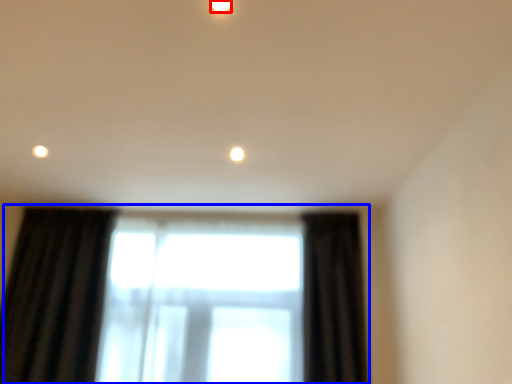
Question: Which object is closer to the camera taking this photo, lighting (highlighted by a red box) or window (highlighted by a blue box)?

Choices:
 (A) lighting
 (B) window

Answer: (A)